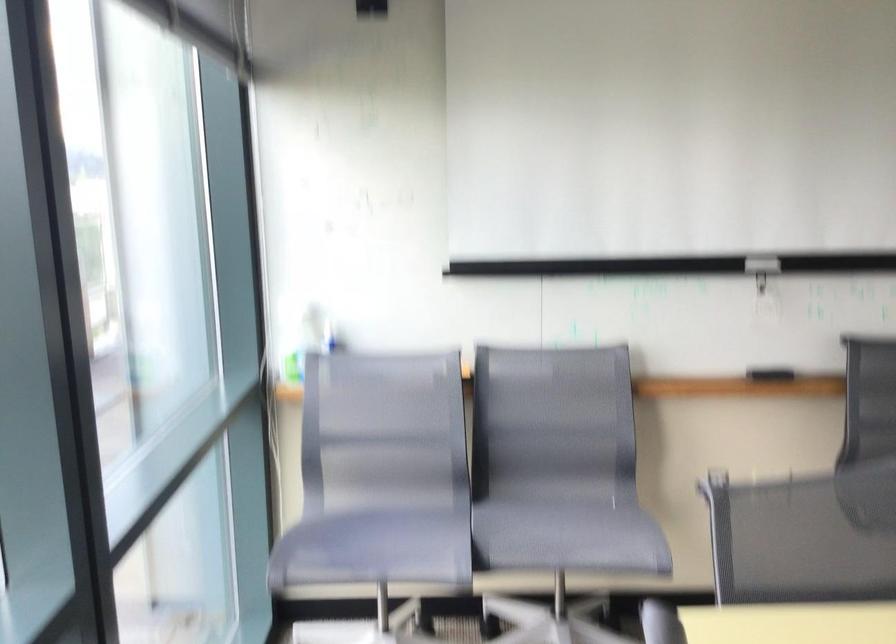
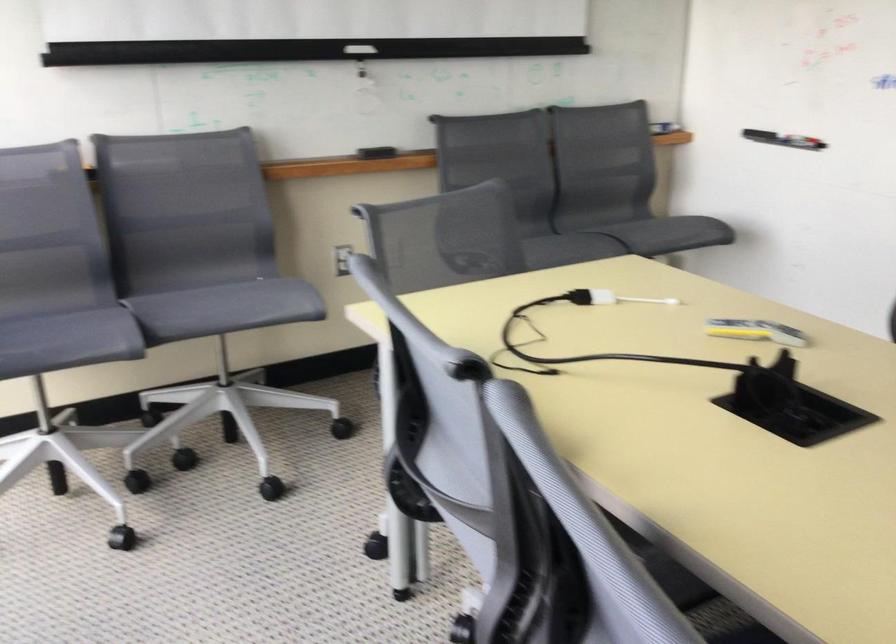
The point at (418, 502) is marked in the first image. Where is the corresponding point in the second image?

(58, 305)